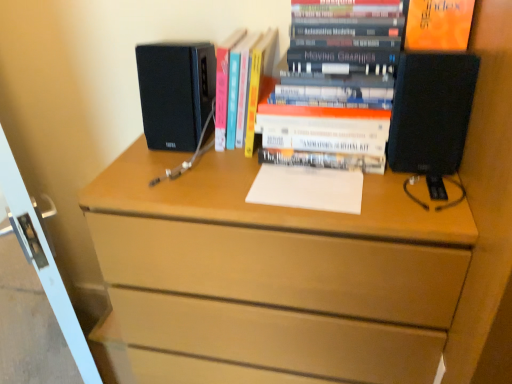
The width and height of the screenshot is (512, 384). Identify the location of free location in front of hardcover book at center, the 2th book positioned from the right. (210, 170).